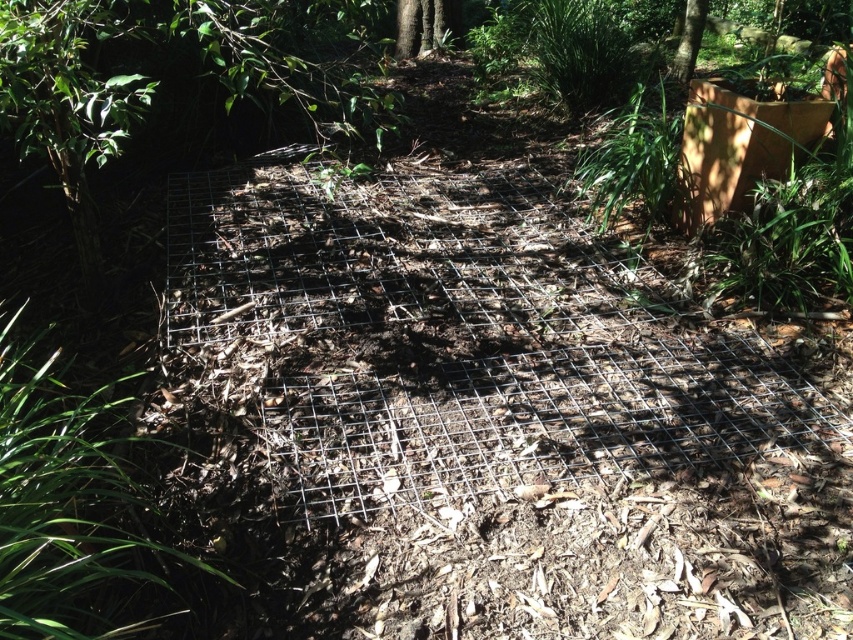
Question: Can you confirm if green grass at lower left is wider than green textured tree trunk at upper center?

Choices:
 (A) no
 (B) yes

Answer: (B)

Question: Which point is closer to the camera?

Choices:
 (A) green grass at lower left
 (B) green textured tree trunk at upper center

Answer: (A)

Question: Is green grass at lower left further to camera compared to green textured tree trunk at upper center?

Choices:
 (A) no
 (B) yes

Answer: (A)

Question: Which object is closer to the camera taking this photo?

Choices:
 (A) green textured tree trunk at upper center
 (B) green grass at lower left

Answer: (B)

Question: Which point is closer to the camera taking this photo?

Choices:
 (A) (x=126, y=508)
 (B) (x=695, y=17)

Answer: (A)

Question: Is green grass at lower left to the right of green textured tree trunk at upper center from the viewer's perspective?

Choices:
 (A) no
 (B) yes

Answer: (A)